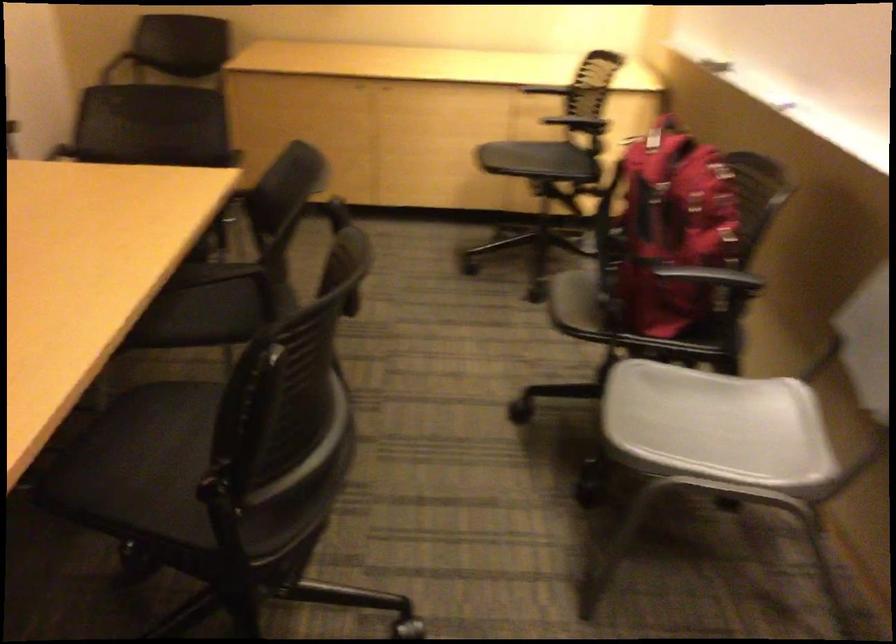
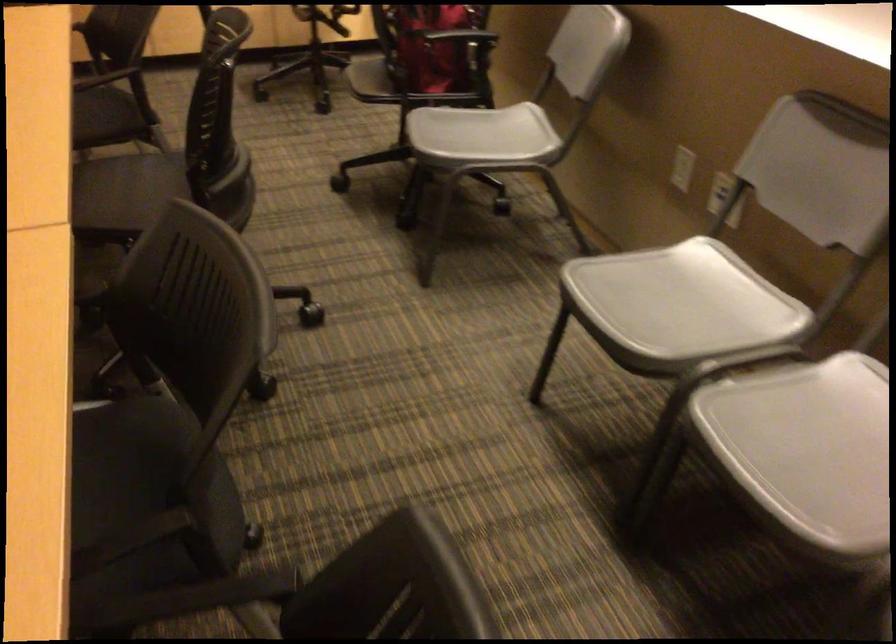
Find the pixel in the second image that matches the point at 243,306 in the first image.

(100, 111)